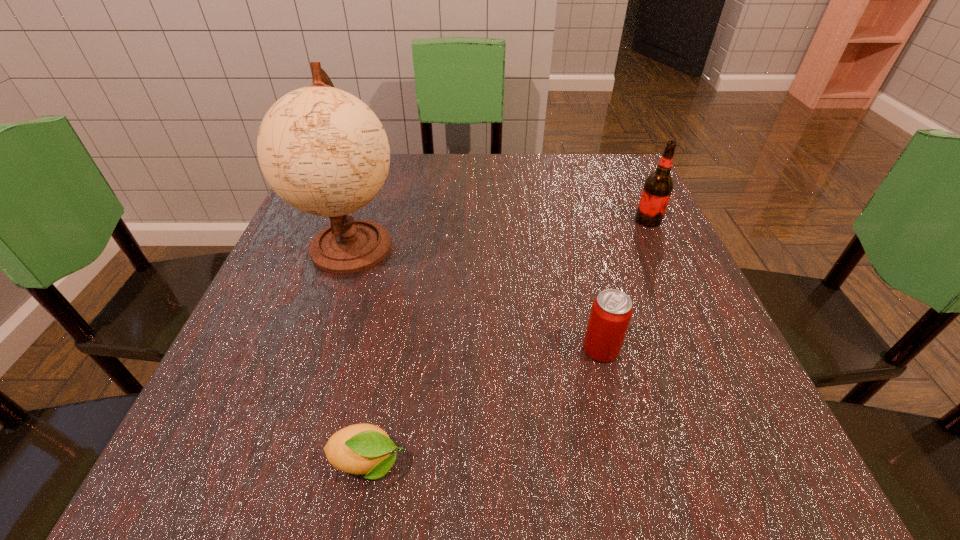
You are a GUI agent. You are given a task and a screenshot of the screen. Output one action in this format:
    pyautogui.click(x=<x>, y=<y>)
    Task: Click on the globe
    The width and height of the screenshot is (960, 540).
    Given the screenshot: What is the action you would take?
    pyautogui.click(x=322, y=150)

Identify the location of the second tallest object. This screenshot has width=960, height=540. (658, 186).

At what (x,y) coordinates should I click in order to perform the action: click on the rightmost object. Please return your answer as a coordinate pair (x, y). The height and width of the screenshot is (540, 960). Looking at the image, I should click on (658, 186).

The height and width of the screenshot is (540, 960). What are the coordinates of `can` in the screenshot? It's located at (611, 312).

Locate an element on the screen. This screenshot has height=540, width=960. the second object from right to left is located at coordinates (611, 312).

At what (x,y) coordinates should I click in order to perform the action: click on lemon. Please return your answer as a coordinate pair (x, y). The width and height of the screenshot is (960, 540). Looking at the image, I should click on (358, 449).

Identify the location of the nearest object. This screenshot has width=960, height=540. (358, 449).

The width and height of the screenshot is (960, 540). I want to click on vacant space located on the surface of the tallest object, so click(331, 307).

At what (x,y) coordinates should I click in order to perform the action: click on free region located on the left of the third shortest object. Please return your answer as a coordinate pair (x, y). The height and width of the screenshot is (540, 960). Looking at the image, I should click on (546, 220).

This screenshot has height=540, width=960. What are the coordinates of `vacant space situated 0.080m on the back of the third object from left to right` in the screenshot? It's located at (588, 299).